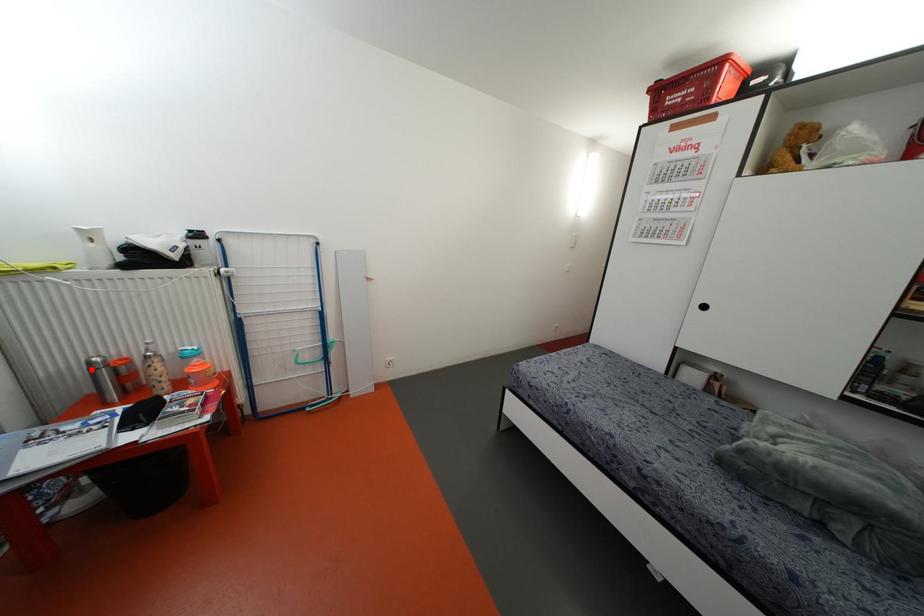
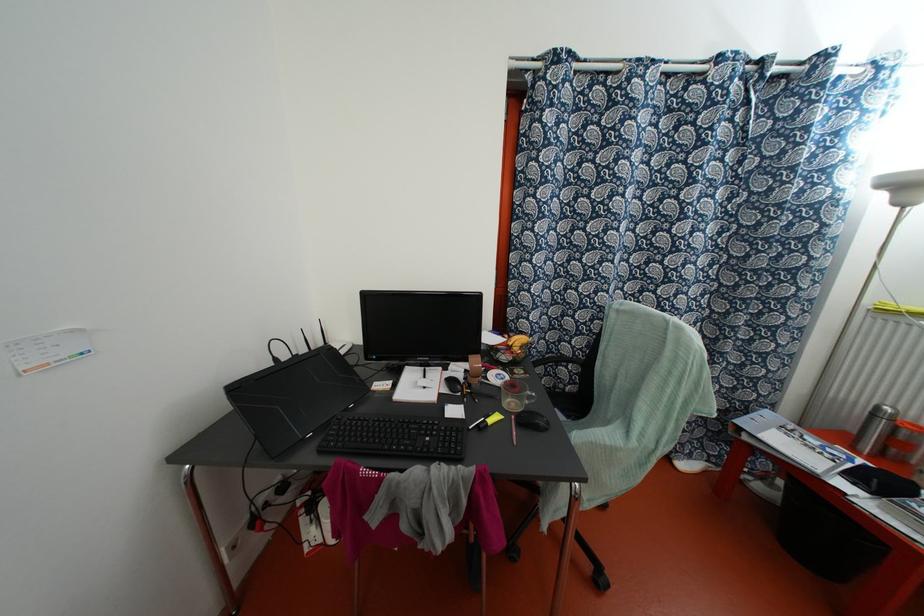
Locate, in the second image, the point that corresponds to the highlighted location in the first image.

(872, 415)